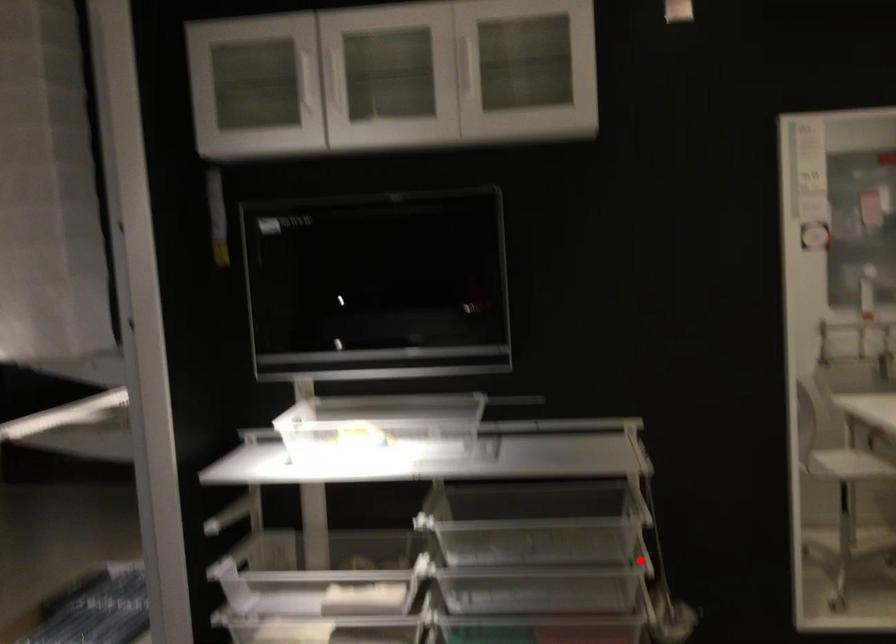
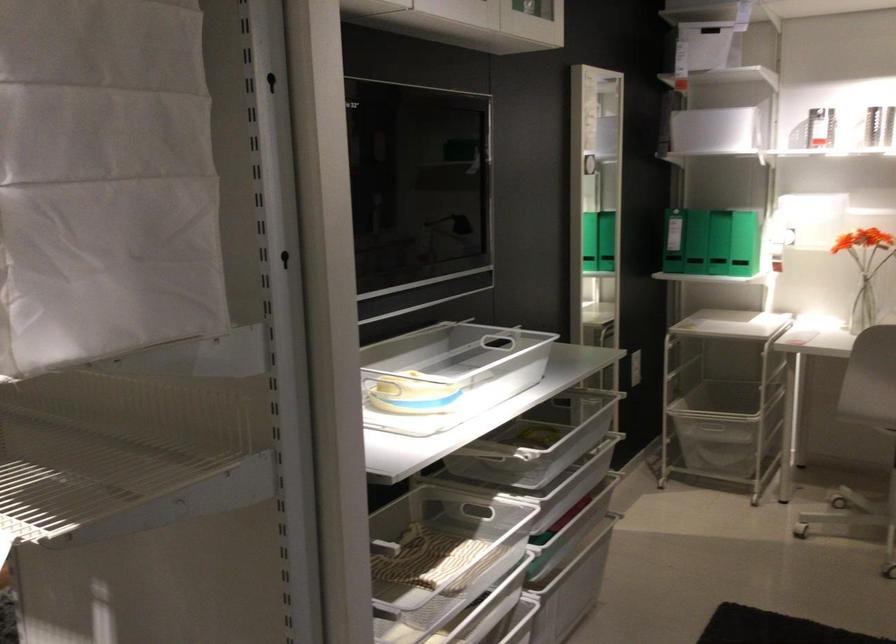
Locate, in the second image, the point that corresponds to the highlighted location in the first image.

(561, 428)